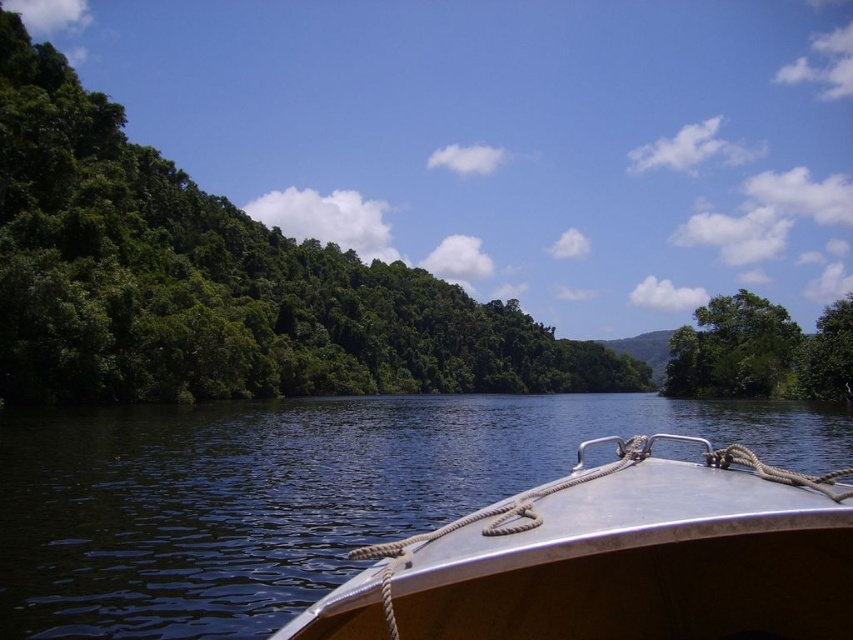
Question: Is green leafy trees at left wider than metallic boat at center?

Choices:
 (A) yes
 (B) no

Answer: (A)

Question: Is green leafy trees at left positioned at the back of green leafy tree at right?

Choices:
 (A) no
 (B) yes

Answer: (A)

Question: Which point appears closest to the camera in this image?

Choices:
 (A) (648, 595)
 (B) (172, 355)
 (C) (671, 374)

Answer: (A)

Question: Is metallic boat at center smaller than green leafy tree at right?

Choices:
 (A) yes
 (B) no

Answer: (A)

Question: Which of the following is the farthest from the observer?

Choices:
 (A) (608, 572)
 (B) (518, 330)
 (C) (712, 339)

Answer: (B)

Question: Which point is closer to the camera?

Choices:
 (A) green leafy trees at left
 (B) green leafy tree at right
 (C) metallic boat at center

Answer: (C)